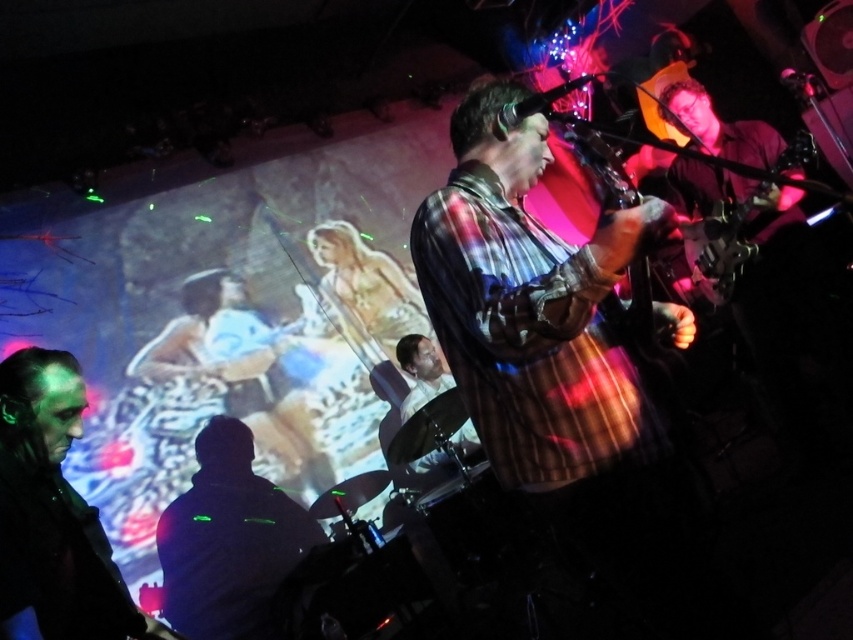
Can you confirm if plaid shirt guitar at center is wider than metallic guitar at center?

Yes.

From the picture: Who is positioned more to the left, plaid shirt guitar at center or metallic guitar at center?

From the viewer's perspective, plaid shirt guitar at center appears more on the left side.

Identify the location of plaid shirt guitar at center. (554, 362).

Find the location of a particular element. The image size is (853, 640). plaid shirt guitar at center is located at coordinates click(x=554, y=362).